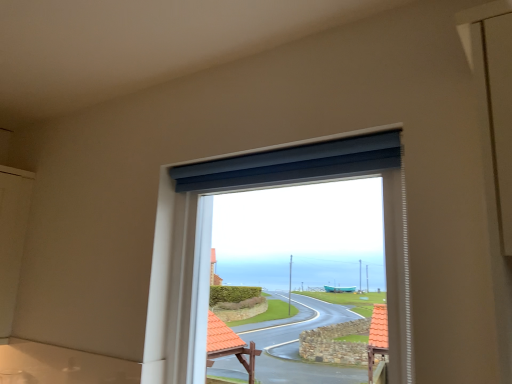
Image resolution: width=512 pixels, height=384 pixels. Describe the element at coordinates (292, 164) in the screenshot. I see `matte blue curtain at upper center` at that location.

Measure the distance between matte blue curtain at upper center and camera.

matte blue curtain at upper center and camera are 1.12 meters apart from each other.

Where is `matte blue curtain at upper center`? This screenshot has width=512, height=384. matte blue curtain at upper center is located at coordinates (292, 164).

The height and width of the screenshot is (384, 512). In order to click on matte blue roller blind at center in this screenshot , I will do `click(279, 185)`.

The width and height of the screenshot is (512, 384). Describe the element at coordinates (279, 185) in the screenshot. I see `matte blue roller blind at center` at that location.

What is the approximate height of matte blue roller blind at center?

It is 31.93 inches.

The image size is (512, 384). I want to click on matte blue curtain at upper center, so click(x=292, y=164).

Between matte blue curtain at upper center and matte blue roller blind at center, which one appears on the left side from the viewer's perspective?

matte blue curtain at upper center.

Which object is closer to the camera, matte blue curtain at upper center or matte blue roller blind at center?

Positioned in front is matte blue roller blind at center.

Between point (274, 165) and point (266, 167), which one is positioned behind?

The point (266, 167) is more distant.

From the image's perspective, who appears lower, matte blue curtain at upper center or matte blue roller blind at center?

From the image's view, matte blue roller blind at center is below.

From a real-world perspective, which is physically below, matte blue curtain at upper center or matte blue roller blind at center?

From a 3D spatial view, matte blue roller blind at center is below.

Between matte blue curtain at upper center and matte blue roller blind at center, which one has larger width?

matte blue roller blind at center is wider.

In terms of height, does matte blue curtain at upper center look taller or shorter compared to matte blue roller blind at center?

matte blue curtain at upper center is shorter than matte blue roller blind at center.

Can you confirm if matte blue curtain at upper center is bigger than matte blue roller blind at center?

No.

Would you say matte blue curtain at upper center is inside or outside matte blue roller blind at center?

matte blue curtain at upper center is not enclosed by matte blue roller blind at center.

Are matte blue curtain at upper center and matte blue roller blind at center far apart?

That's not correct — matte blue curtain at upper center is a little close to matte blue roller blind at center.

Is matte blue curtain at upper center facing towards matte blue roller blind at center?

No, matte blue curtain at upper center does not turn towards matte blue roller blind at center.

At what (x,y) coordinates should I click in order to perform the action: click on window in front of the matte blue curtain at upper center. Please return your answer as a coordinate pair (x, y). Looking at the image, I should click on (279, 185).

Considering the relative positions of matte blue roller blind at center and matte blue curtain at upper center in the image provided, is matte blue roller blind at center to the left of matte blue curtain at upper center from the viewer's perspective?

No, matte blue roller blind at center is not to the left of matte blue curtain at upper center.

Which object is further away from the camera taking this photo, matte blue roller blind at center or matte blue curtain at upper center?

matte blue curtain at upper center is further from the camera.

Considering the points (392, 213) and (263, 158), which point is behind, point (392, 213) or point (263, 158)?

Point (263, 158)

From the image's perspective, is matte blue roller blind at center located beneath matte blue curtain at upper center?

Indeed, from the image's perspective, matte blue roller blind at center is shown beneath matte blue curtain at upper center.

From a real-world perspective, who is located lower, matte blue roller blind at center or matte blue curtain at upper center?

In real-world perspective, matte blue roller blind at center is lower.

Can you confirm if matte blue roller blind at center is wider than matte blue curtain at upper center?

Correct, the width of matte blue roller blind at center exceeds that of matte blue curtain at upper center.

Which of these two, matte blue roller blind at center or matte blue curtain at upper center, stands shorter?

With less height is matte blue curtain at upper center.

Is matte blue roller blind at center bigger or smaller than matte blue curtain at upper center?

matte blue roller blind at center is bigger than matte blue curtain at upper center.

Is matte blue roller blind at center inside the boundaries of matte blue curtain at upper center, or outside?

matte blue roller blind at center exists outside the volume of matte blue curtain at upper center.

Is matte blue roller blind at center touching matte blue curtain at upper center?

Yes, matte blue roller blind at center is in contact with matte blue curtain at upper center.

Is matte blue roller blind at center oriented away from matte blue curtain at upper center?

No, matte blue curtain at upper center is not at the back of matte blue roller blind at center.

Measure the distance from matte blue roller blind at center to matte blue curtain at upper center.

A distance of 9.36 centimeters exists between matte blue roller blind at center and matte blue curtain at upper center.

I want to click on curtain lying behind the matte blue roller blind at center, so click(292, 164).

Identify the location of window on the right of matte blue curtain at upper center. (279, 185).

Identify the location of curtain on the left of matte blue roller blind at center. (292, 164).